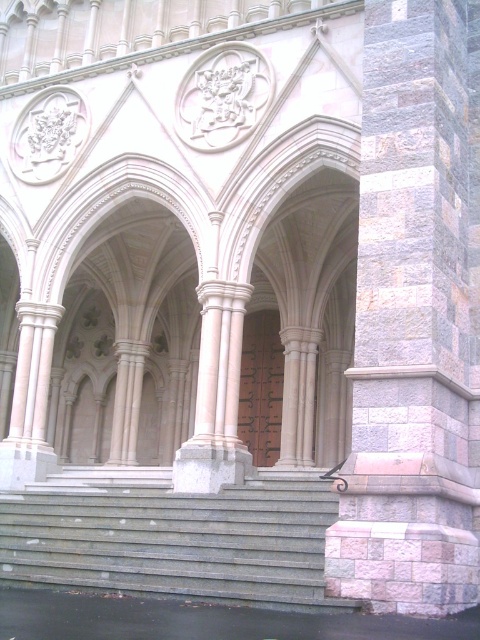
The width and height of the screenshot is (480, 640). What do you see at coordinates (172, 536) in the screenshot?
I see `gray stone stairs at lower left` at bounding box center [172, 536].

Is gray stone stairs at lower left smaller than brown wooden door at center?

No, gray stone stairs at lower left is not smaller than brown wooden door at center.

What do you see at coordinates (172, 536) in the screenshot? This screenshot has width=480, height=640. I see `gray stone stairs at lower left` at bounding box center [172, 536].

This screenshot has width=480, height=640. I want to click on gray stone stairs at lower left, so click(172, 536).

You are a GUI agent. You are given a task and a screenshot of the screen. Output one action in this format:
    pyautogui.click(x=<x>, y=<y>)
    Task: Click on the stone textured pillar at right
    The height and width of the screenshot is (640, 480).
    Given the screenshot: What is the action you would take?
    pyautogui.click(x=415, y=320)

Can you confirm if stone textured pillar at right is shorter than brown wooden door at center?

In fact, stone textured pillar at right may be taller than brown wooden door at center.

Is point (404, 273) farther from camera compared to point (260, 396)?

No.

At what (x,y) coordinates should I click in order to perform the action: click on stone textured pillar at right. Please return your answer as a coordinate pair (x, y). Image resolution: width=480 pixels, height=640 pixels. Looking at the image, I should click on (415, 320).

Does stone textured pillar at right have a greater width compared to gray stone stairs at lower left?

In fact, stone textured pillar at right might be narrower than gray stone stairs at lower left.

The image size is (480, 640). What do you see at coordinates (415, 320) in the screenshot?
I see `stone textured pillar at right` at bounding box center [415, 320].

Find the location of `stone textured pillar at right`. stone textured pillar at right is located at coordinates (415, 320).